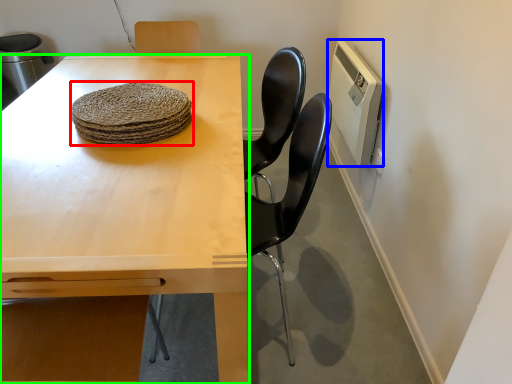
Question: Which is farther away from food (highlighted by a red box)? appliance (highlighted by a blue box) or table (highlighted by a green box)?

Choices:
 (A) appliance
 (B) table

Answer: (A)